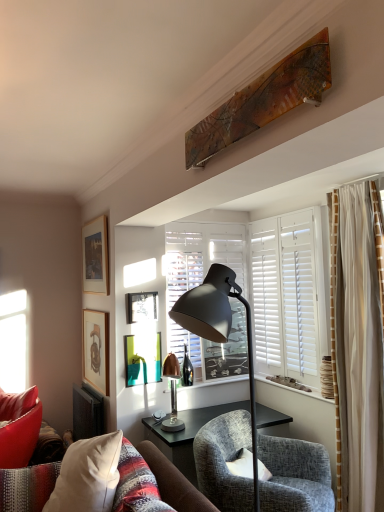
What do you see at coordinates (200, 284) in the screenshot? The width and height of the screenshot is (384, 512). I see `white matte window at center` at bounding box center [200, 284].

What are the coordinates of `wooden matte picture frame at upper left, positioned as the fourth picture frame in top-to-bottom order` in the screenshot? It's located at (96, 349).

Where is `matte black picture frame at upper center, which ranks as the 3th picture frame in bottom-to-top order`? This screenshot has height=512, width=384. matte black picture frame at upper center, which ranks as the 3th picture frame in bottom-to-top order is located at coordinates (141, 307).

The image size is (384, 512). I want to click on wooden picture frame at upper left, placed as the fourth picture frame when sorted from bottom to top, so click(x=95, y=256).

Find the location of a particular element. The width and height of the screenshot is (384, 512). lamp that is above the teal glossy picture frame at center, the third picture frame when ordered from top to bottom (from the image's perspective) is located at coordinates (219, 328).

Is matte black lamp at center, the 1th lamp when ordered from front to back, positioned in front of teal glossy picture frame at center, the third picture frame when ordered from top to bottom?

That is True.

Considering the sizes of objects matte black lamp at center, the 1th lamp when ordered from front to back, and teal glossy picture frame at center, the third picture frame when ordered from top to bottom, in the image provided, who is thinner, matte black lamp at center, the 1th lamp when ordered from front to back, or teal glossy picture frame at center, the third picture frame when ordered from top to bottom,?

Thinner between the two is teal glossy picture frame at center, the third picture frame when ordered from top to bottom.

In the scene shown: Looking at the image, does matte black lamp at center, the 1th lamp when ordered from front to back, seem bigger or smaller compared to teal glossy picture frame at center, which is counted as the second picture frame, starting from the bottom?

Considering their sizes, matte black lamp at center, the 1th lamp when ordered from front to back, takes up more space than teal glossy picture frame at center, which is counted as the second picture frame, starting from the bottom.

At what (x,y) coordinates should I click in order to perform the action: click on window to the right of teal glossy picture frame at center, which is counted as the second picture frame, starting from the bottom. Please return your answer as a coordinate pair (x, y). This screenshot has height=512, width=384. Looking at the image, I should click on (200, 284).

Looking at this image, which object is positioned more to the left, teal glossy picture frame at center, the third picture frame when ordered from top to bottom, or white matte window at center?

From the viewer's perspective, teal glossy picture frame at center, the third picture frame when ordered from top to bottom, appears more on the left side.

Is teal glossy picture frame at center, which is counted as the second picture frame, starting from the bottom, turned away from white matte window at center?

No, teal glossy picture frame at center, which is counted as the second picture frame, starting from the bottom, is not facing the opposite direction of white matte window at center.

From the picture: Is teal glossy picture frame at center, which is counted as the second picture frame, starting from the bottom, further to camera compared to white matte window at center?

No, teal glossy picture frame at center, which is counted as the second picture frame, starting from the bottom, is closer to the camera.

From the image's perspective, is wooden matte picture frame at upper left, positioned as the fourth picture frame in top-to-bottom order, under matte black lamp at center, the 1th lamp when ordered from front to back?

Indeed, from the image's perspective, wooden matte picture frame at upper left, positioned as the fourth picture frame in top-to-bottom order, is shown beneath matte black lamp at center, the 1th lamp when ordered from front to back.

Is wooden matte picture frame at upper left, the 1th picture frame ordered from the bottom, not inside matte black lamp at center, arranged as the 2th lamp when viewed from the back?

Yes.

Considering the sizes of objects wooden matte picture frame at upper left, positioned as the fourth picture frame in top-to-bottom order, and matte black lamp at center, the 1th lamp when ordered from front to back, in the image provided, who is smaller, wooden matte picture frame at upper left, positioned as the fourth picture frame in top-to-bottom order, or matte black lamp at center, the 1th lamp when ordered from front to back,?

Smaller between the two is wooden matte picture frame at upper left, positioned as the fourth picture frame in top-to-bottom order.

Is the position of wooden matte picture frame at upper left, positioned as the fourth picture frame in top-to-bottom order, more distant than that of matte black lamp at center, the 1th lamp when ordered from front to back?

Yes, it is behind matte black lamp at center, the 1th lamp when ordered from front to back.

Which is more to the left, matte black picture frame at upper center, which ranks as the 3th picture frame in bottom-to-top order, or teal glossy picture frame at center, which is counted as the second picture frame, starting from the bottom?

Positioned to the left is matte black picture frame at upper center, which ranks as the 3th picture frame in bottom-to-top order.

Is matte black picture frame at upper center, which ranks as the 3th picture frame in bottom-to-top order, in front of teal glossy picture frame at center, which is counted as the second picture frame, starting from the bottom?

No, matte black picture frame at upper center, which ranks as the 3th picture frame in bottom-to-top order, is further to the viewer.

How many degrees apart are the facing directions of matte black picture frame at upper center, which ranks as the 3th picture frame in bottom-to-top order, and teal glossy picture frame at center, which is counted as the second picture frame, starting from the bottom?

There is a 0.00728-degree angle between the facing directions of matte black picture frame at upper center, which ranks as the 3th picture frame in bottom-to-top order, and teal glossy picture frame at center, which is counted as the second picture frame, starting from the bottom.

Looking at this image, is velvet white pillow at lower left directly adjacent to copper metallic lamp at center, the 2th lamp from the front?

velvet white pillow at lower left is not next to copper metallic lamp at center, the 2th lamp from the front, and they're not touching.

Considering the relative positions of velvet white pillow at lower left and copper metallic lamp at center, which ranks as the first lamp in back-to-front order, in the image provided, is velvet white pillow at lower left to the left or to the right of copper metallic lamp at center, which ranks as the first lamp in back-to-front order,?

velvet white pillow at lower left is positioned on copper metallic lamp at center, which ranks as the first lamp in back-to-front order,'s left side.

Is point (167, 508) less distant than point (172, 407)?

Yes, point (167, 508) is in front of point (172, 407).

Choose the correct answer: Is white matte window at center inside matte black lamp at center, arranged as the 2th lamp when viewed from the back, or outside it?

white matte window at center is outside matte black lamp at center, arranged as the 2th lamp when viewed from the back.

Based on their sizes in the image, would you say white matte window at center is bigger or smaller than matte black lamp at center, arranged as the 2th lamp when viewed from the back?

In the image, white matte window at center appears to be smaller than matte black lamp at center, arranged as the 2th lamp when viewed from the back.

From the image's perspective, is white matte window at center positioned above or below matte black lamp at center, the 1th lamp when ordered from front to back?

white matte window at center is above matte black lamp at center, the 1th lamp when ordered from front to back.

Is copper metallic lamp at center, the 2th lamp from the front, behind wooden matte picture frame at upper left, the 1th picture frame ordered from the bottom?

No, the depth of copper metallic lamp at center, the 2th lamp from the front, is less than that of wooden matte picture frame at upper left, the 1th picture frame ordered from the bottom.

From the image's perspective, count 1st picture frames upward from the copper metallic lamp at center, which ranks as the first lamp in back-to-front order, and point to it. Please provide its 2D coordinates.

[(96, 349)]

Can you confirm if copper metallic lamp at center, the 2th lamp from the front, is wider than wooden matte picture frame at upper left, the 1th picture frame ordered from the bottom?

Indeed, copper metallic lamp at center, the 2th lamp from the front, has a greater width compared to wooden matte picture frame at upper left, the 1th picture frame ordered from the bottom.

Would you say copper metallic lamp at center, the 2th lamp from the front, is a long distance from wooden matte picture frame at upper left, the 1th picture frame ordered from the bottom?

copper metallic lamp at center, the 2th lamp from the front, is near wooden matte picture frame at upper left, the 1th picture frame ordered from the bottom, not far away.

The width and height of the screenshot is (384, 512). Identify the location of lamp above the teal glossy picture frame at center, which is counted as the second picture frame, starting from the bottom (from a real-world perspective). (219, 328).

Where is `the 2nd picture frame below the white matte window at center (from the image's perspective)`? the 2nd picture frame below the white matte window at center (from the image's perspective) is located at coordinates (142, 359).

Looking at the image, which one is located further to matte black picture frame at upper center, which ranks as the 3th picture frame in bottom-to-top order, matte black lamp at center, arranged as the 2th lamp when viewed from the back, or velvet white pillow at lower left?

Among the two, matte black lamp at center, arranged as the 2th lamp when viewed from the back, is located further to matte black picture frame at upper center, which ranks as the 3th picture frame in bottom-to-top order.

From the image, which object appears to be nearer to white matte window at center, teal glossy picture frame at center, the third picture frame when ordered from top to bottom, or matte black picture frame at upper center, which is the second picture frame in top-to-bottom order?

matte black picture frame at upper center, which is the second picture frame in top-to-bottom order.

From the image, which object appears to be nearer to textured gray armchair at center, teal glossy picture frame at center, the third picture frame when ordered from top to bottom, or matte black picture frame at upper center, which is the second picture frame in top-to-bottom order?

teal glossy picture frame at center, the third picture frame when ordered from top to bottom, lies closer to textured gray armchair at center than the other object.

Estimate the real-world distances between objects in this image. Which object is closer to teal glossy picture frame at center, the third picture frame when ordered from top to bottom, textured gray armchair at center or wooden picture frame at upper left, placed as the fourth picture frame when sorted from bottom to top?

Based on the image, wooden picture frame at upper left, placed as the fourth picture frame when sorted from bottom to top, appears to be nearer to teal glossy picture frame at center, the third picture frame when ordered from top to bottom.

Which object lies further to the anchor point wooden picture frame at upper left, acting as the first picture frame starting from the top, white matte window at center or wooden matte picture frame at upper left, positioned as the fourth picture frame in top-to-bottom order?

white matte window at center lies further to wooden picture frame at upper left, acting as the first picture frame starting from the top, than the other object.

When comparing their distances from textured gray armchair at center, does wooden matte picture frame at upper left, positioned as the fourth picture frame in top-to-bottom order, or white matte window at center seem further?

Based on the image, wooden matte picture frame at upper left, positioned as the fourth picture frame in top-to-bottom order, appears to be further to textured gray armchair at center.

Based on the photo, estimate the real-world distances between objects in this image. Which object is closer to wooden picture frame at upper left, placed as the fourth picture frame when sorted from bottom to top, teal glossy picture frame at center, which is counted as the second picture frame, starting from the bottom, or wooden matte picture frame at upper left, positioned as the fourth picture frame in top-to-bottom order?

wooden matte picture frame at upper left, positioned as the fourth picture frame in top-to-bottom order, is positioned closer to the anchor wooden picture frame at upper left, placed as the fourth picture frame when sorted from bottom to top.

From the image, which object appears to be nearer to copper metallic lamp at center, which ranks as the first lamp in back-to-front order, wooden matte picture frame at upper left, the 1th picture frame ordered from the bottom, or wooden picture frame at upper left, acting as the first picture frame starting from the top?

wooden matte picture frame at upper left, the 1th picture frame ordered from the bottom, is positioned closer to the anchor copper metallic lamp at center, which ranks as the first lamp in back-to-front order.

The width and height of the screenshot is (384, 512). Find the location of `lamp between textured gray armchair at center and wooden matte picture frame at upper left, positioned as the fourth picture frame in top-to-bottom order, from front to back`. lamp between textured gray armchair at center and wooden matte picture frame at upper left, positioned as the fourth picture frame in top-to-bottom order, from front to back is located at coordinates (172, 393).

Find the location of a particular element. The height and width of the screenshot is (512, 384). chair between matte black lamp at center, arranged as the 2th lamp when viewed from the back, and teal glossy picture frame at center, which is counted as the second picture frame, starting from the bottom, in the front-back direction is located at coordinates 295,476.

Where is `lamp between matte black lamp at center, arranged as the 2th lamp when viewed from the back, and wooden matte picture frame at upper left, positioned as the fourth picture frame in top-to-bottom order, in the front-back direction`? This screenshot has width=384, height=512. lamp between matte black lamp at center, arranged as the 2th lamp when viewed from the back, and wooden matte picture frame at upper left, positioned as the fourth picture frame in top-to-bottom order, in the front-back direction is located at coordinates (172, 393).

Find the location of a particular element. The height and width of the screenshot is (512, 384). chair between velvet white pillow at lower left and white matte window at center along the z-axis is located at coordinates (295, 476).